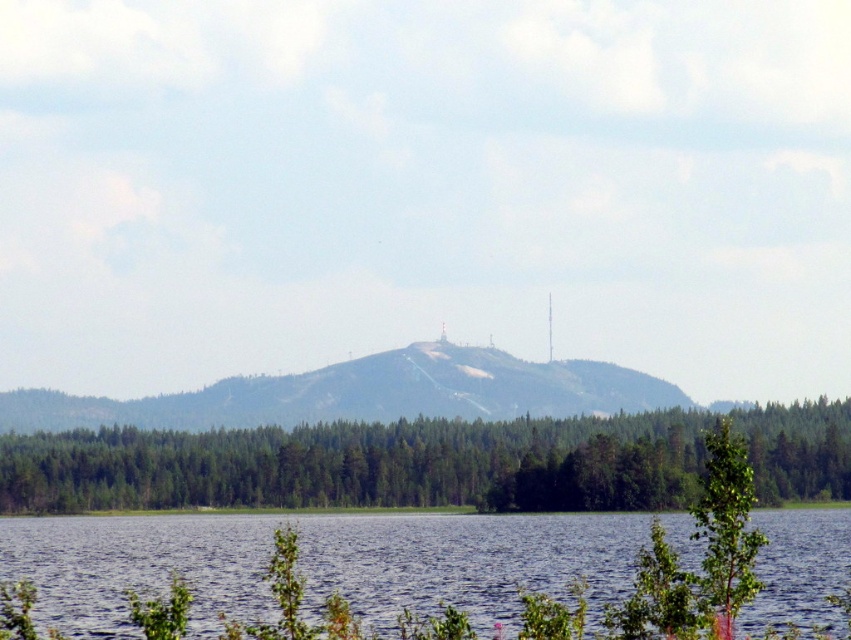
Question: Is blue water at lower center wider than green matte tree at lower center?

Choices:
 (A) no
 (B) yes

Answer: (A)

Question: Which point appears closest to the camera in this image?

Choices:
 (A) (478, 557)
 (B) (233, 416)
 (C) (403, 426)

Answer: (A)

Question: Which is farther from the green matte tree at lower center?

Choices:
 (A) green forested mountain at center
 (B) blue water at lower center

Answer: (A)

Question: Which object appears closest to the camera in this image?

Choices:
 (A) green matte tree at lower center
 (B) blue water at lower center
 (C) green forested mountain at center

Answer: (B)

Question: Observing the image, what is the correct spatial positioning of blue water at lower center in reference to green forested mountain at center?

Choices:
 (A) below
 (B) above

Answer: (A)

Question: In this image, where is blue water at lower center located relative to green matte tree at lower center?

Choices:
 (A) right
 (B) left

Answer: (A)